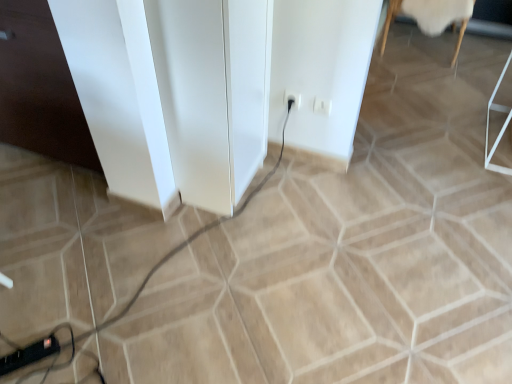
The width and height of the screenshot is (512, 384). What do you see at coordinates (213, 93) in the screenshot?
I see `white glossy file cabinet at center, the second file cabinet from the left` at bounding box center [213, 93].

Find the location of `white glossy file cabinet at center, acting as the 1th file cabinet starting from the right`. white glossy file cabinet at center, acting as the 1th file cabinet starting from the right is located at coordinates (213, 93).

The height and width of the screenshot is (384, 512). Identify the location of black rubber cable at lower left. (190, 241).

How much space does white glossy file cabinet at left, placed as the second file cabinet when sorted from right to left, occupy horizontally?

25.14 inches.

The image size is (512, 384). What do you see at coordinates (29, 354) in the screenshot?
I see `black plastic extension cord at lower left` at bounding box center [29, 354].

At what (x,y) coordinates should I click in order to perform the action: click on white woolen rug at upper right. Please return your answer as a coordinate pair (x, y). The image size is (512, 384). Looking at the image, I should click on (431, 17).

In order to face white woolen rug at upper right, should I rotate leftwards or rightwards?

To face it directly, rotate right by 22.322 degrees.

What do you see at coordinates (322, 106) in the screenshot? I see `white plastic socket at center` at bounding box center [322, 106].

Image resolution: width=512 pixels, height=384 pixels. Find the location of `white glossy file cabinet at center, the second file cabinet from the left`. white glossy file cabinet at center, the second file cabinet from the left is located at coordinates (213, 93).

Relative to white glossy file cabinet at left, the 1th file cabinet positioned from the left, is white glossy file cabinet at center, the second file cabinet from the left, in front or behind?

→ white glossy file cabinet at center, the second file cabinet from the left, is positioned closer to the viewer than white glossy file cabinet at left, the 1th file cabinet positioned from the left.

From the image's perspective, is white glossy file cabinet at center, acting as the 1th file cabinet starting from the right, above white glossy file cabinet at left, the 1th file cabinet positioned from the left?

Actually, white glossy file cabinet at center, acting as the 1th file cabinet starting from the right, appears below white glossy file cabinet at left, the 1th file cabinet positioned from the left, in the image.

Based on their sizes in the image, would you say white glossy file cabinet at center, the second file cabinet from the left, is bigger or smaller than white glossy file cabinet at left, the 1th file cabinet positioned from the left?

Clearly, white glossy file cabinet at center, the second file cabinet from the left, is smaller in size than white glossy file cabinet at left, the 1th file cabinet positioned from the left.

Could you tell me if white glossy file cabinet at center, the second file cabinet from the left, is turned towards white glossy file cabinet at left, placed as the second file cabinet when sorted from right to left?

No, white glossy file cabinet at center, the second file cabinet from the left, is not aimed at white glossy file cabinet at left, placed as the second file cabinet when sorted from right to left.

Can you tell me how much white glossy file cabinet at left, placed as the second file cabinet when sorted from right to left, and white plastic electric outlet at center-right differ in facing direction?

The angle between the facing direction of white glossy file cabinet at left, placed as the second file cabinet when sorted from right to left, and the facing direction of white plastic electric outlet at center-right is 2.48 degrees.

Considering the positions of objects white glossy file cabinet at left, placed as the second file cabinet when sorted from right to left, and white plastic electric outlet at center-right in the image provided, who is more to the left, white glossy file cabinet at left, placed as the second file cabinet when sorted from right to left, or white plastic electric outlet at center-right?

From the viewer's perspective, white glossy file cabinet at left, placed as the second file cabinet when sorted from right to left, appears more on the left side.

From the image's perspective, is white glossy file cabinet at left, the 1th file cabinet positioned from the left, under white plastic electric outlet at center-right?

No, from the image's perspective, white glossy file cabinet at left, the 1th file cabinet positioned from the left, is not beneath white plastic electric outlet at center-right.

From the picture: Is white glossy file cabinet at left, placed as the second file cabinet when sorted from right to left, wider or thinner than white plastic electric outlet at center-right?

Considering their sizes, white glossy file cabinet at left, placed as the second file cabinet when sorted from right to left, looks broader than white plastic electric outlet at center-right.

Does white glossy file cabinet at left, the 1th file cabinet positioned from the left, have a larger size compared to white woolen rug at upper right?

Yes.

How much distance is there between white glossy file cabinet at left, the 1th file cabinet positioned from the left, and white woolen rug at upper right?

white glossy file cabinet at left, the 1th file cabinet positioned from the left, is 8.44 feet away from white woolen rug at upper right.

Considering the points (61, 111) and (424, 1), which point is in front, point (61, 111) or point (424, 1)?

The point (61, 111) is more forward.

Between point (35, 354) and point (33, 61), which one is positioned behind?

Positioned behind is point (33, 61).

From a real-world perspective, does black plastic extension cord at lower left stand above white glossy file cabinet at left, the 1th file cabinet positioned from the left?

No, from a real-world perspective, black plastic extension cord at lower left is not above white glossy file cabinet at left, the 1th file cabinet positioned from the left.

Considering the positions of objects black plastic extension cord at lower left and white glossy file cabinet at left, placed as the second file cabinet when sorted from right to left, in the image provided, who is more to the right, black plastic extension cord at lower left or white glossy file cabinet at left, placed as the second file cabinet when sorted from right to left,?

black plastic extension cord at lower left.

Is white glossy file cabinet at left, placed as the second file cabinet when sorted from right to left, located within white plastic socket at center?

Actually, white glossy file cabinet at left, placed as the second file cabinet when sorted from right to left, is outside white plastic socket at center.

Is white plastic socket at center closer to camera compared to white glossy file cabinet at left, the 1th file cabinet positioned from the left?

No.

Could you tell me if white plastic socket at center is turned towards white glossy file cabinet at left, placed as the second file cabinet when sorted from right to left?

No, white plastic socket at center is not turned towards white glossy file cabinet at left, placed as the second file cabinet when sorted from right to left.

Based on the photo, who is shorter, white plastic socket at center or white glossy file cabinet at left, placed as the second file cabinet when sorted from right to left?

With less height is white plastic socket at center.

Between black rubber cable at lower left and white woolen rug at upper right, which one has less height?

With less height is black rubber cable at lower left.

Does black rubber cable at lower left contain white woolen rug at upper right?

No.

Can you see black rubber cable at lower left touching white woolen rug at upper right?

black rubber cable at lower left and white woolen rug at upper right are clearly separated.

Which is more to the right, white woolen rug at upper right or black plastic extension cord at lower left?

From the viewer's perspective, white woolen rug at upper right appears more on the right side.

Does white woolen rug at upper right have a greater width compared to black plastic extension cord at lower left?

Yes, white woolen rug at upper right is wider than black plastic extension cord at lower left.

Are white woolen rug at upper right and black plastic extension cord at lower left far apart?

white woolen rug at upper right is far away from black plastic extension cord at lower left.

How different are the orientations of white woolen rug at upper right and black plastic extension cord at lower left in degrees?

38.6 degrees.

In the image, there is a white glossy file cabinet at center, the second file cabinet from the left. What are the coordinates of `file cabinet above it (from the image's perspective)` in the screenshot? It's located at (40, 88).

Starting from the white plastic electric outlet at center-right, which file cabinet is the 2nd one to the left? Please provide its 2D coordinates.

[(40, 88)]

Which object lies nearer to the anchor point black rubber cable at lower left, white plastic socket at center or white plastic electric outlet at center-right?

Based on the image, white plastic electric outlet at center-right appears to be nearer to black rubber cable at lower left.

Estimate the real-world distances between objects in this image. Which object is closer to white plastic electric outlet at center-right, black plastic extension cord at lower left or white woolen rug at upper right?

black plastic extension cord at lower left lies closer to white plastic electric outlet at center-right than the other object.

When comparing their distances from white glossy file cabinet at center, acting as the 1th file cabinet starting from the right, does white woolen rug at upper right or black rubber cable at lower left seem further?

white woolen rug at upper right lies further to white glossy file cabinet at center, acting as the 1th file cabinet starting from the right, than the other object.

In the scene shown: When comparing their distances from white glossy file cabinet at left, placed as the second file cabinet when sorted from right to left, does white plastic socket at center or black plastic extension cord at lower left seem closer?

black plastic extension cord at lower left is closer to white glossy file cabinet at left, placed as the second file cabinet when sorted from right to left.

When comparing their distances from white glossy file cabinet at left, placed as the second file cabinet when sorted from right to left, does black plastic extension cord at lower left or white woolen rug at upper right seem further?

white woolen rug at upper right.

Estimate the real-world distances between objects in this image. Which object is further from black plastic extension cord at lower left, white glossy file cabinet at center, the second file cabinet from the left, or white glossy file cabinet at left, placed as the second file cabinet when sorted from right to left?

white glossy file cabinet at center, the second file cabinet from the left, lies further to black plastic extension cord at lower left than the other object.

Which object lies nearer to the anchor point white plastic socket at center, black rubber cable at lower left or white woolen rug at upper right?

Based on the image, black rubber cable at lower left appears to be nearer to white plastic socket at center.

Estimate the real-world distances between objects in this image. Which object is closer to white plastic electric outlet at center-right, white woolen rug at upper right or white plastic socket at center?

The object closer to white plastic electric outlet at center-right is white plastic socket at center.

What are the coordinates of `file cabinet situated between white glossy file cabinet at left, the 1th file cabinet positioned from the left, and white plastic electric outlet at center-right from left to right` in the screenshot? It's located at [x=213, y=93].

The image size is (512, 384). Identify the location of socket between black rubber cable at lower left and white woolen rug at upper right in the horizontal direction. (322, 106).

Identify the location of electric outlet between white glossy file cabinet at left, the 1th file cabinet positioned from the left, and white woolen rug at upper right, in the horizontal direction. (293, 98).

The image size is (512, 384). I want to click on cable between white glossy file cabinet at left, the 1th file cabinet positioned from the left, and black plastic extension cord at lower left vertically, so click(190, 241).